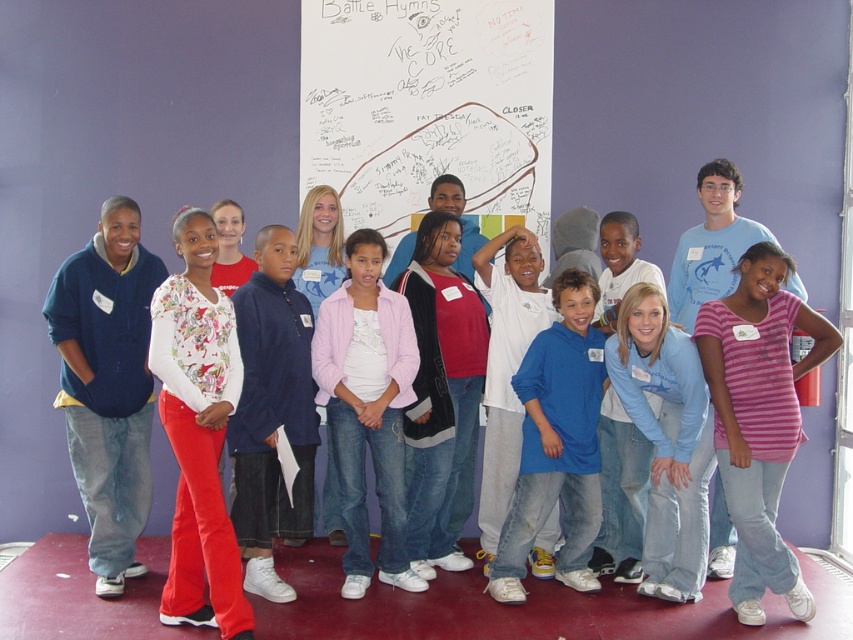
You are a photographer setting up for a group photo. You need to ensure that both the pink cotton jacket at center and the blue fleece jacket at center can fit within a 1.2 meter wide backdrop. Given their widths, will both jackets fit side by side?

The pink cotton jacket at center is narrower than the blue fleece jacket at center. However, without knowing the exact width of the blue fleece jacket, we cannot determine if their combined width exceeds 1.2 meters. More information is needed.

You are a photographer standing in front of the whiteboard. You want to take a photo that includes both the pink cotton jacket at center and the blue fleece jacket at center. What is the minimum distance you need to move backward to ensure both jackets are fully visible in the frame?

The pink cotton jacket at center and blue fleece jacket at center are 31.01 inches apart. To include both in the frame, you need to move backward until the camera can capture a field of view that accommodates this distance. The exact distance depends on the camera lens and sensor size, but generally, moving back until the jackets appear within the frame edges would work.